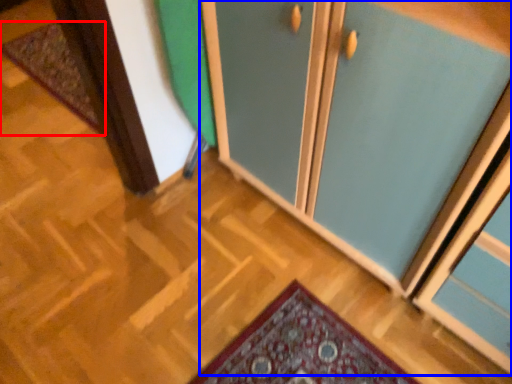
Question: Which point is further to the camera, mat (highlighted by a red box) or cupboard (highlighted by a blue box)?

Choices:
 (A) mat
 (B) cupboard

Answer: (A)